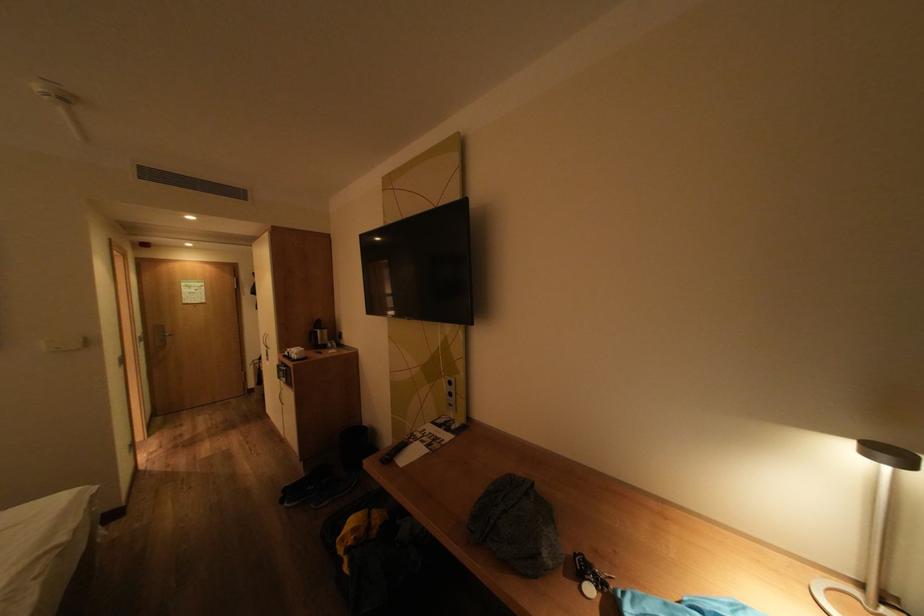
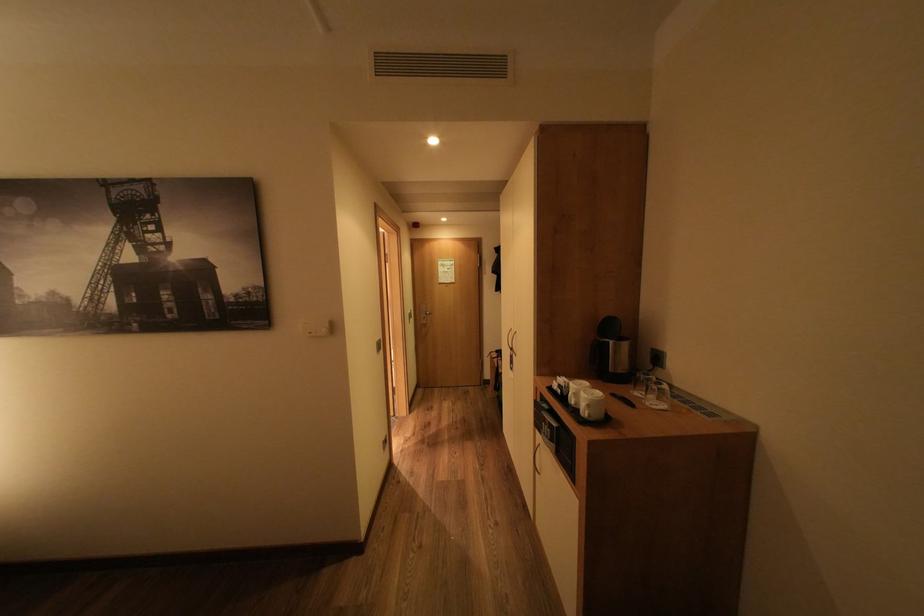
In the second image, find the point that corresponds to point (326, 353) in the first image.

(624, 395)